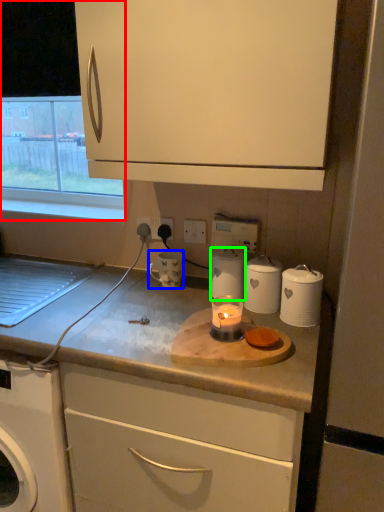
Question: Which object is the farthest from window (highlighted by a red box)? Choose among these: mug (highlighted by a blue box) or kitchen appliance (highlighted by a green box).

Choices:
 (A) mug
 (B) kitchen appliance

Answer: (B)